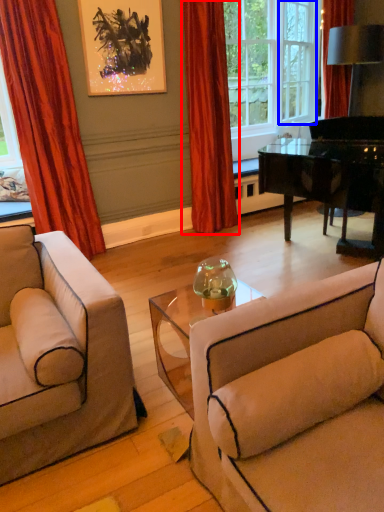
Question: Which object is further to the camera taking this photo, curtain (highlighted by a red box) or window frame (highlighted by a blue box)?

Choices:
 (A) curtain
 (B) window frame

Answer: (B)